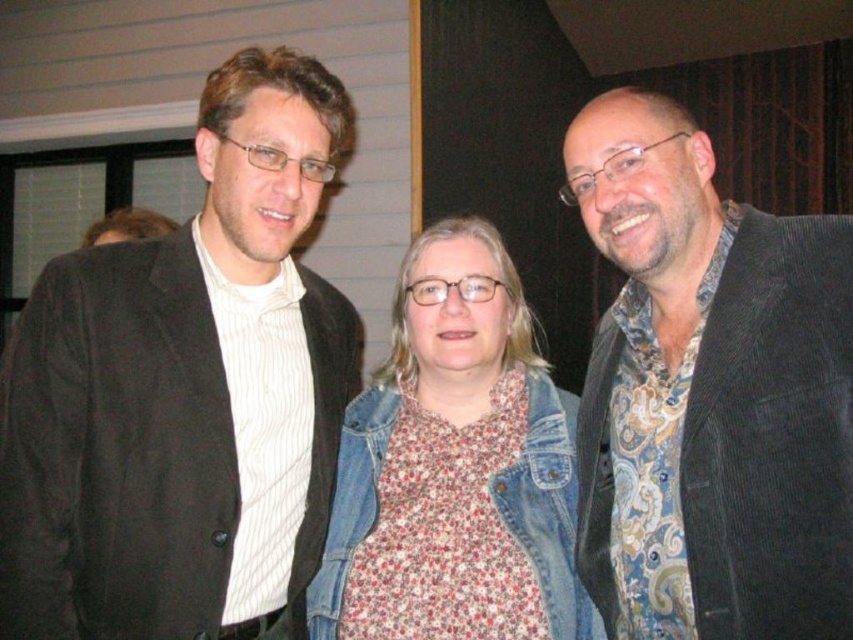
You are standing in the room and want to hand a document to the person wearing the matte black jacket at left. Based on their position in the image, which direction should you move to approach them?

Since the matte black jacket at left is positioned at point 0.616 on the x axis and 0.218 on the y axis, you should move towards the lower right direction to approach them.

You are standing at the point marked as point (x=824, y=538) in the image. You want to reach the window in the background. The window is 10 feet away from your current position. Can you walk straight ahead to the window without moving sideways?

The point (x=824, y=538) and viewer are 3.68 feet apart. Since the window is 10 feet away from your current position, you can walk straight ahead to the window without moving sideways as the distance is sufficient.